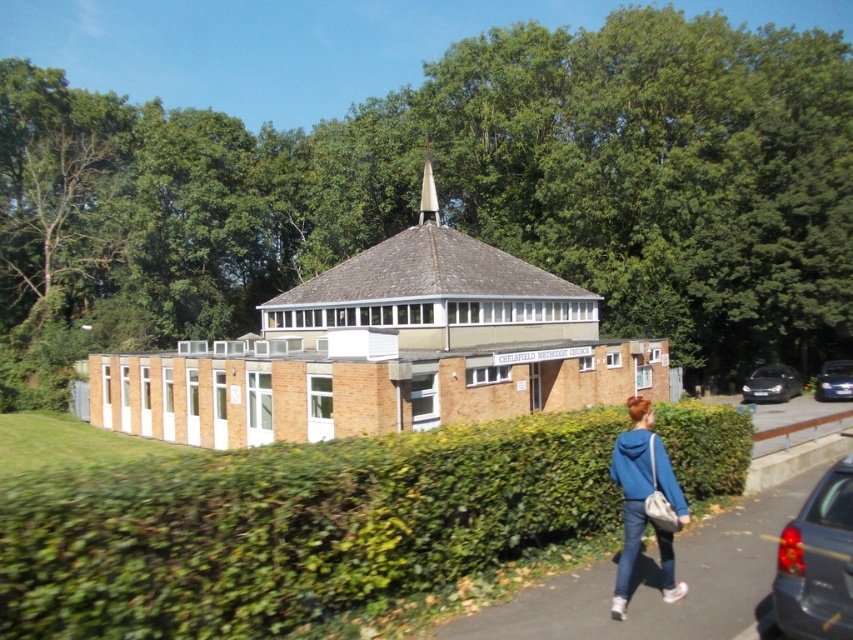
Question: Which of the following is the farthest from the observer?

Choices:
 (A) blue fleece sweatshirt at lower right
 (B) shiny black sedan at right

Answer: (B)

Question: Which point is closer to the camera?

Choices:
 (A) (660, 460)
 (B) (814, 504)
 (C) (427, 180)

Answer: (B)

Question: Observing the image, what is the correct spatial positioning of metallic gray sedan at lower right in reference to blue fleece jacket at lower right?

Choices:
 (A) right
 (B) left

Answer: (A)

Question: In this image, where is blue fleece sweatshirt at lower right located relative to metallic silver car at right?

Choices:
 (A) above
 (B) below

Answer: (A)

Question: Observing the image, what is the correct spatial positioning of metallic gray sedan at lower right in reference to blue fleece sweatshirt at lower right?

Choices:
 (A) right
 (B) left

Answer: (A)

Question: Among these objects, which one is nearest to the camera?

Choices:
 (A) metallic gray sedan at lower right
 (B) blue fleece jacket at lower right

Answer: (A)